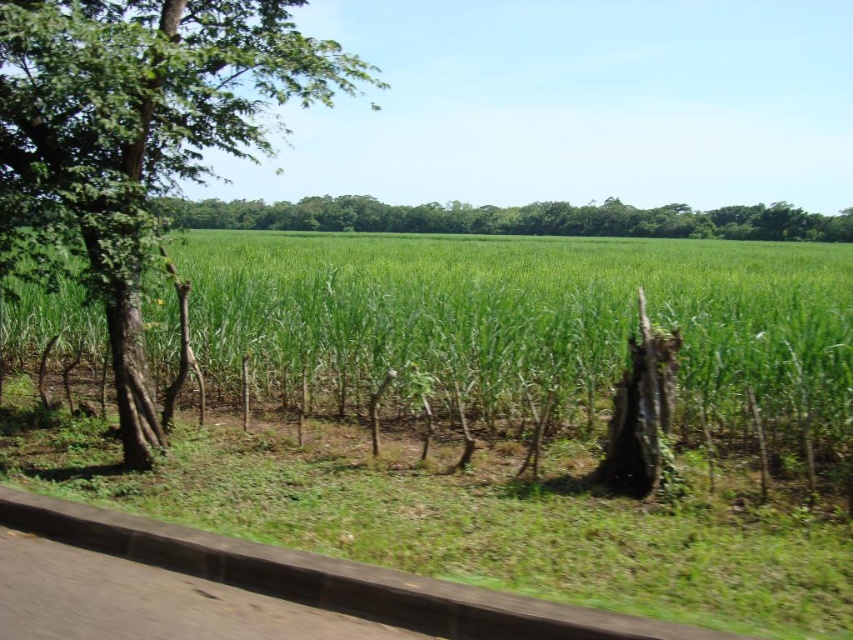
You are standing in the sugarcane plantation and want to walk from the green grassy field at center to the green leafy tree at center. Which direction should you move to reach the tree?

The green grassy field at center is positioned on the left side of the green leafy tree at center, so you should move to the right to reach the tree.

You are a farmer standing in the sugarcane field and want to plant a new row of sugarcane between the green leafy tree at left and the green leafy tree at center. Which tree should you use as a reference point if you want the row closer to the smaller tree?

The green leafy tree at left is smaller, so you should use it as the reference point to plant the new row closer to it.